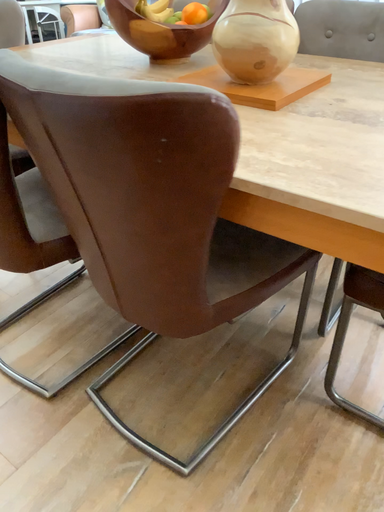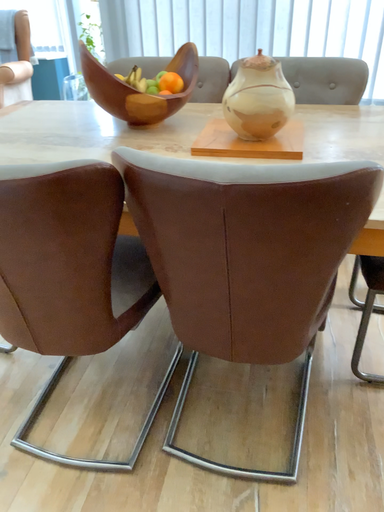
Question: Which way did the camera rotate in the video?

Choices:
 (A) rotated downward
 (B) rotated upward

Answer: (B)